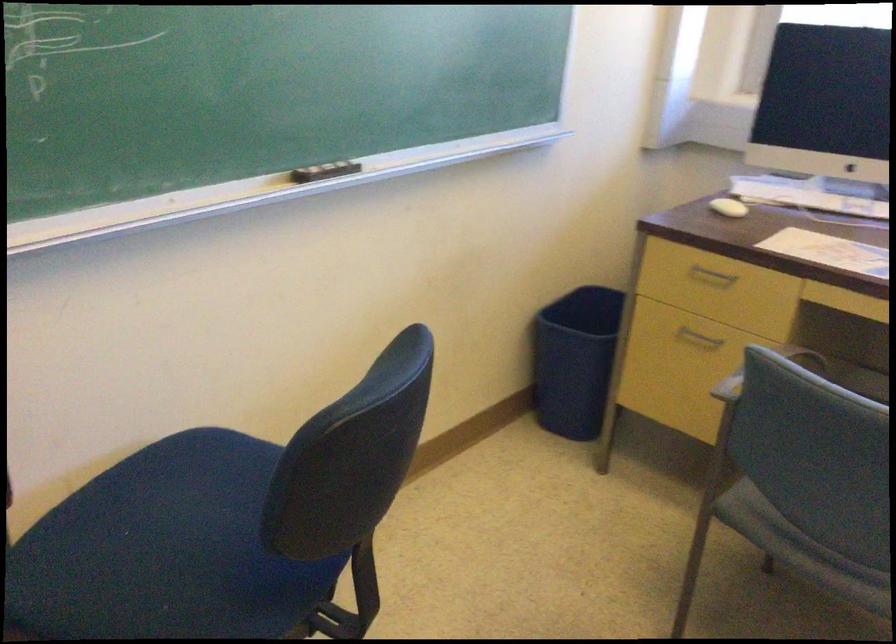
Locate an element on the screen. Image resolution: width=896 pixels, height=644 pixels. blue trash can is located at coordinates (574, 360).